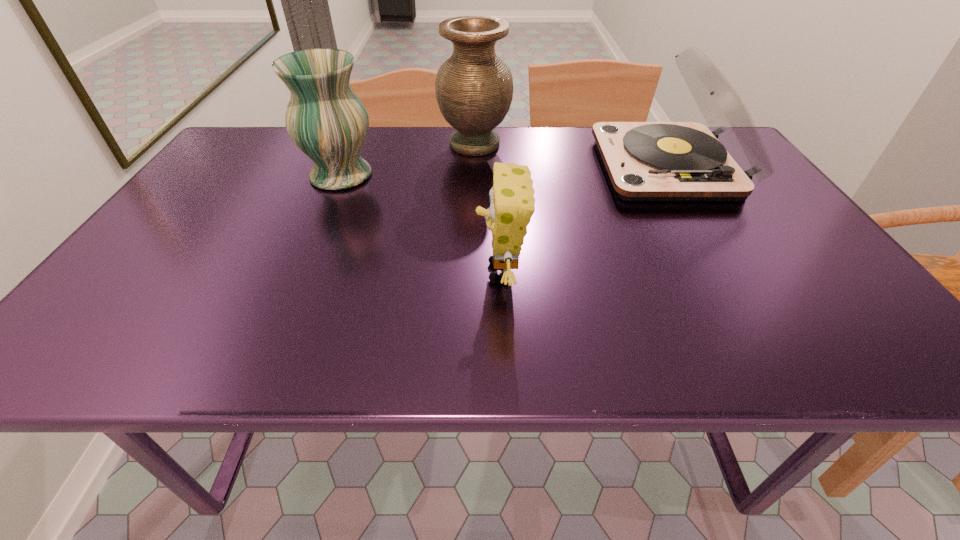
This screenshot has height=540, width=960. Identify the location of vacant space that's between the right vase and the shortest object. (488, 208).

Identify the location of object that is the third closest to the sponge. pos(474,88).

Locate which object ranks second in proximity to the nearest object. Please provide its 2D coordinates. Your answer should be formatted as a tuple, i.e. [(x, y)], where the tuple contains the x and y coordinates of a point satisfying the conditions above.

[(327, 121)]